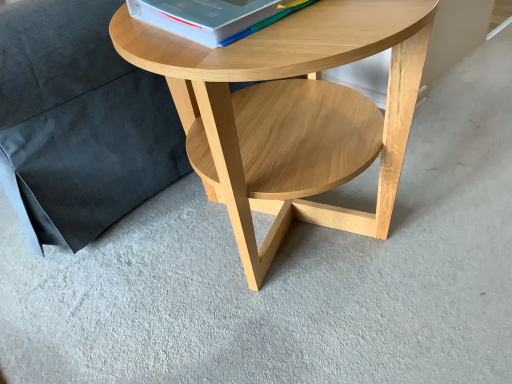
Question: Is black fabric pillow at upper left not inside white paper at upper center?

Choices:
 (A) no
 (B) yes

Answer: (B)

Question: From a real-world perspective, does black fabric pillow at upper left stand above white paper at upper center?

Choices:
 (A) no
 (B) yes

Answer: (A)

Question: Considering the relative sizes of black fabric pillow at upper left and white paper at upper center in the image provided, is black fabric pillow at upper left bigger than white paper at upper center?

Choices:
 (A) no
 (B) yes

Answer: (B)

Question: Is black fabric pillow at upper left looking in the opposite direction of white paper at upper center?

Choices:
 (A) no
 (B) yes

Answer: (A)

Question: Is black fabric pillow at upper left further to camera compared to white paper at upper center?

Choices:
 (A) no
 (B) yes

Answer: (B)

Question: Based on their positions, is white paper at upper center located to the left or right of black fabric pillow at upper left?

Choices:
 (A) right
 (B) left

Answer: (A)

Question: Is white paper at upper center wider or thinner than black fabric pillow at upper left?

Choices:
 (A) wide
 (B) thin

Answer: (B)

Question: In terms of size, does white paper at upper center appear bigger or smaller than black fabric pillow at upper left?

Choices:
 (A) big
 (B) small

Answer: (B)

Question: Is white paper at upper center spatially inside black fabric pillow at upper left, or outside of it?

Choices:
 (A) inside
 (B) outside

Answer: (B)

Question: From a real-world perspective, is natural wood coffee table at center positioned above or below white paper at upper center?

Choices:
 (A) above
 (B) below

Answer: (B)

Question: Based on their sizes in the image, would you say natural wood coffee table at center is bigger or smaller than white paper at upper center?

Choices:
 (A) small
 (B) big

Answer: (B)

Question: Considering the positions of point (118, 48) and point (266, 8), is point (118, 48) closer or farther from the camera than point (266, 8)?

Choices:
 (A) farther
 (B) closer

Answer: (A)

Question: Visually, is natural wood coffee table at center positioned to the left or to the right of white paper at upper center?

Choices:
 (A) left
 (B) right

Answer: (B)

Question: Visually, is white paper at upper center positioned to the left or to the right of natural wood coffee table at center?

Choices:
 (A) left
 (B) right

Answer: (A)

Question: From their relative heights in the image, would you say white paper at upper center is taller or shorter than natural wood coffee table at center?

Choices:
 (A) tall
 (B) short

Answer: (B)